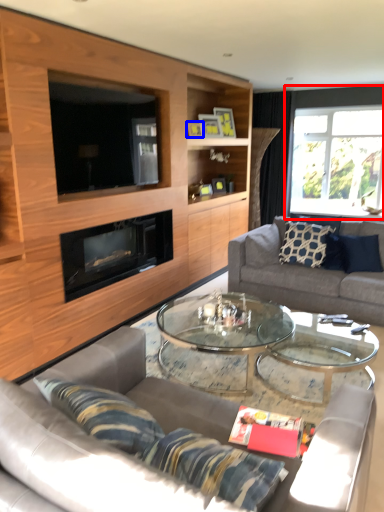
Question: Which object is further to the camera taking this photo, window (highlighted by a red box) or picture frame (highlighted by a blue box)?

Choices:
 (A) window
 (B) picture frame

Answer: (A)